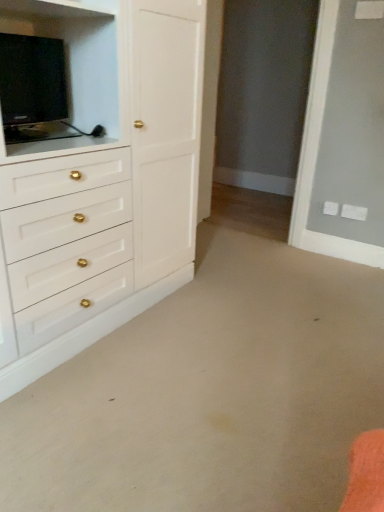
Find the location of `white glossy cabinet at left`. white glossy cabinet at left is located at coordinates (103, 182).

Image resolution: width=384 pixels, height=512 pixels. What do you see at coordinates (103, 182) in the screenshot?
I see `white glossy cabinet at left` at bounding box center [103, 182].

At what (x,y) coordinates should I click in order to perform the action: click on white glossy cabinet at left. Please return your answer as a coordinate pair (x, y). Image resolution: width=384 pixels, height=512 pixels. Looking at the image, I should click on (103, 182).